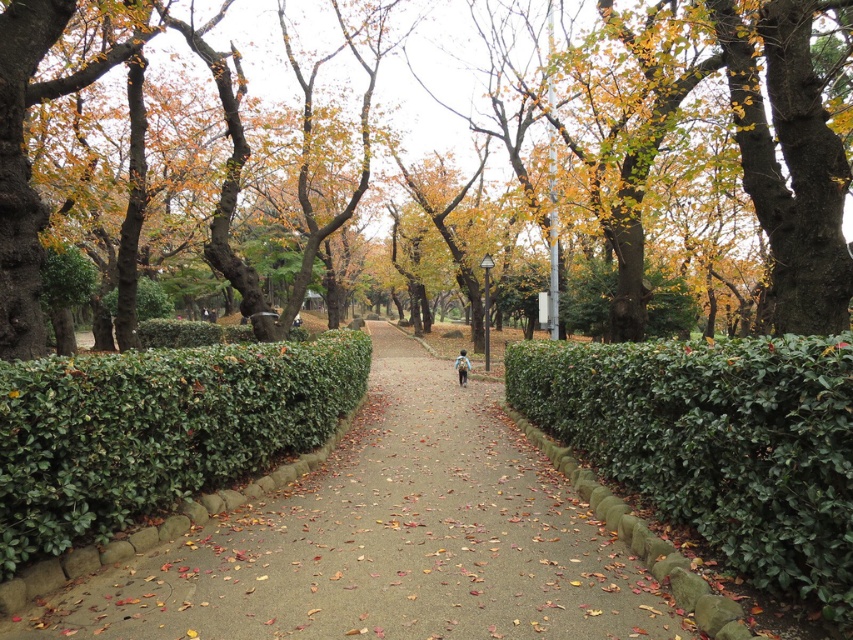
Does green leafy hedge at right have a smaller size compared to brown fabric backpack at center?

No, green leafy hedge at right is not smaller than brown fabric backpack at center.

Describe the element at coordinates (717, 444) in the screenshot. I see `green leafy hedge at right` at that location.

Identify the location of green leafy hedge at right. (717, 444).

Is green concrete pavement at center thinner than green leafy hedge at right?

No, green concrete pavement at center is not thinner than green leafy hedge at right.

Can you confirm if green concrete pavement at center is shorter than green leafy hedge at right?

Indeed, green concrete pavement at center has a lesser height compared to green leafy hedge at right.

Is point (492, 509) in front of point (816, 484)?

That is False.

I want to click on green concrete pavement at center, so click(386, 540).

Who is taller, green concrete pavement at center or brown textured tree at center?

Standing taller between the two is brown textured tree at center.

Consider the image. Can you confirm if green concrete pavement at center is positioned below brown textured tree at center?

Indeed, green concrete pavement at center is positioned under brown textured tree at center.

Locate an element on the screen. The image size is (853, 640). green concrete pavement at center is located at coordinates (386, 540).